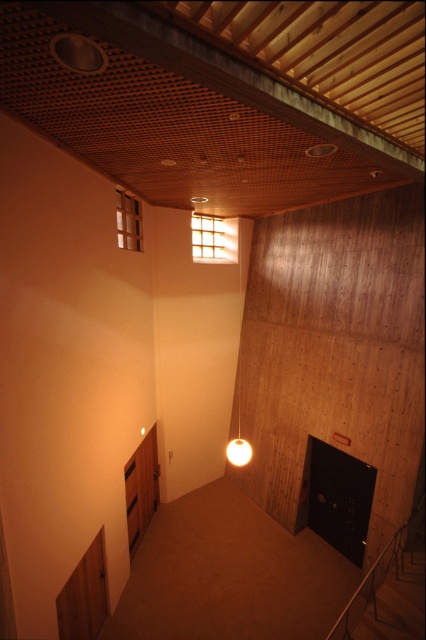
Question: Which of the following is the closest to the observer?

Choices:
 (A) (227, 451)
 (B) (123, 209)
 (C) (209, 220)
 (D) (386, 568)

Answer: (D)

Question: From the image, what is the correct spatial relationship of translucent wooden window at upper center in relation to matte white lampshade at center?

Choices:
 (A) above
 (B) below

Answer: (A)

Question: Which point is closer to the camera taking this photo?

Choices:
 (A) (134, 230)
 (B) (379, 577)

Answer: (B)

Question: Can you confirm if translucent wooden window at upper center is positioned to the right of matte white lampshade at center?

Choices:
 (A) no
 (B) yes

Answer: (A)

Question: Does brown wooden rail at lower right appear under clear glass window at upper center?

Choices:
 (A) yes
 (B) no

Answer: (A)

Question: Considering the real-world distances, which object is farthest from the brown wooden rail at lower right?

Choices:
 (A) translucent wooden window at upper center
 (B) clear glass window at upper center

Answer: (A)